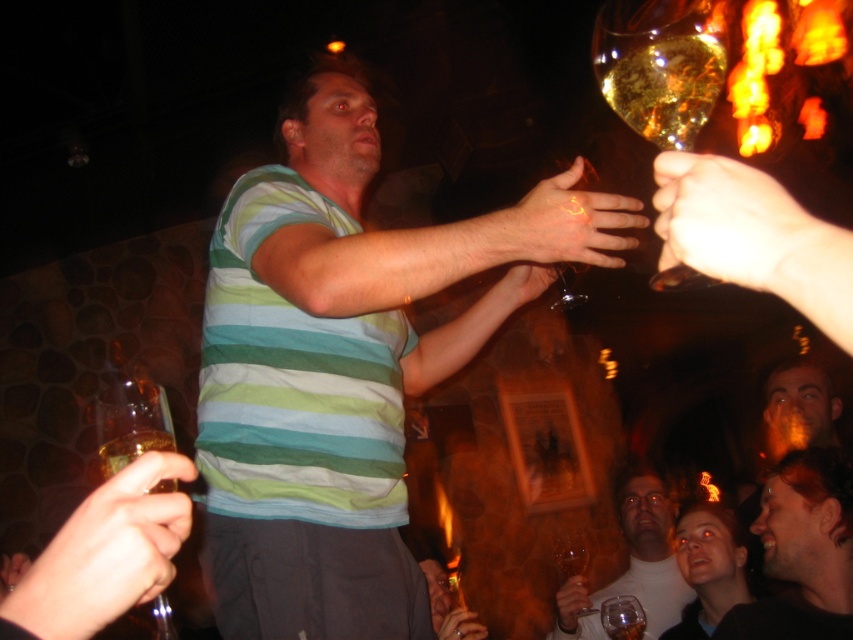
Consider the image. You are a photographer at the event and want to capture a clear shot of the striped cotton shirt at center without the translucent amber glass at upper right blocking it. How should you adjust your camera position?

Move your camera position forward so that the striped cotton shirt at center is closer to the lens, ensuring the translucent amber glass at upper right is out of frame or less obstructive. Alternatively, shift the camera angle slightly to the left or right to avoid the translucent amber glass at upper right being in the same line of sight as the striped cotton shirt at center.

You are a photographer at this event and want to capture a photo where both the shiny golden hair at center and the translucent amber glass at upper center are clearly visible. Considering their heights, which object should you adjust your camera angle to focus on first to ensure both are in frame?

The shiny golden hair at center is much taller than the translucent amber glass at upper center, so you should focus on the taller shiny golden hair at center first to ensure the camera angle accommodates its height, then adjust to include the shorter translucent amber glass at upper center.

You are a photographer trying to capture the central figure in the image. The striped cotton shirt at center and the translucent glass wine glass at lower center are both in the frame. Which object should you focus on if you want to ensure the widest part of the subject is in sharp focus?

You should focus on the striped cotton shirt at center because it might be wider than the translucent glass wine glass at lower center, ensuring the widest part is captured clearly.